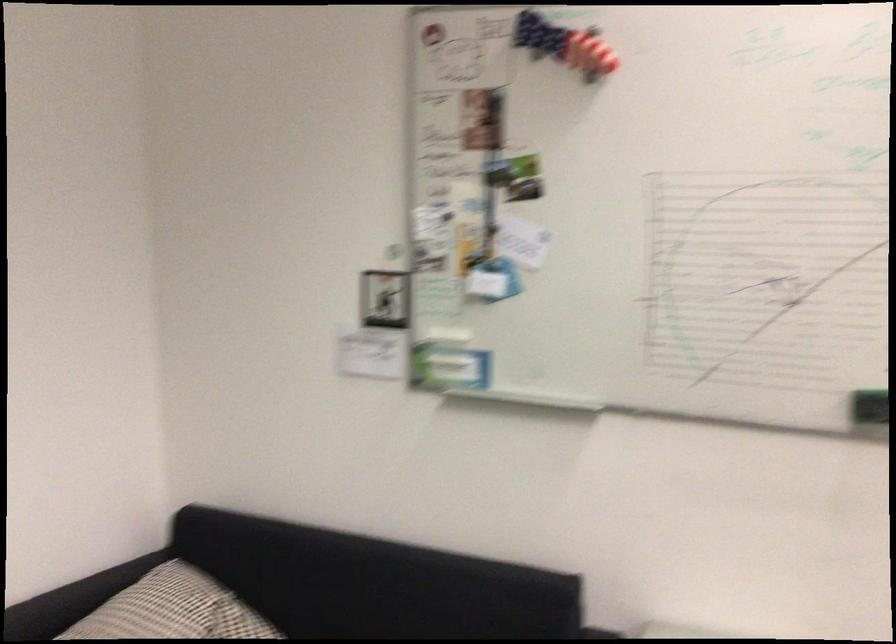
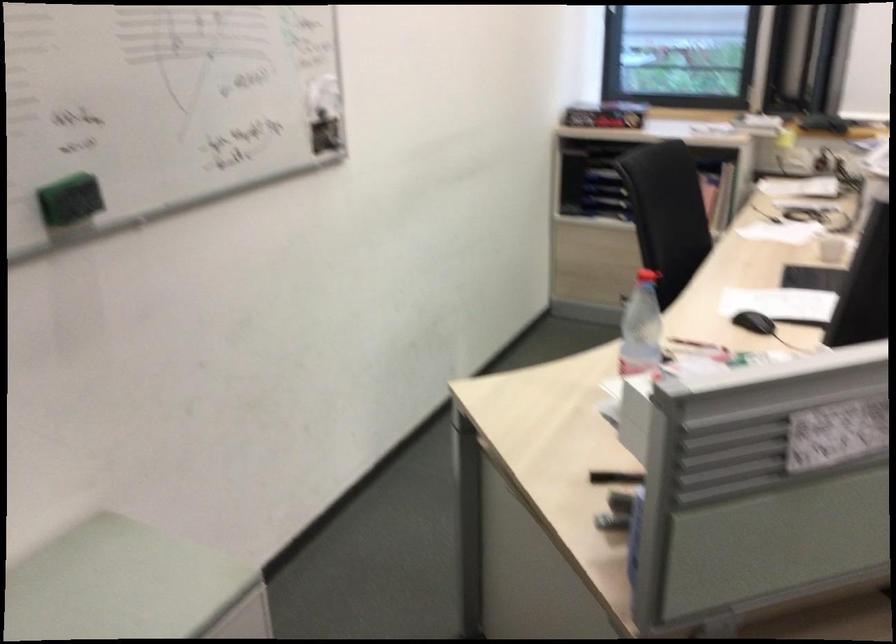
First-person continuous shooting, in which direction is the camera rotating?

The camera rotated toward right-down.